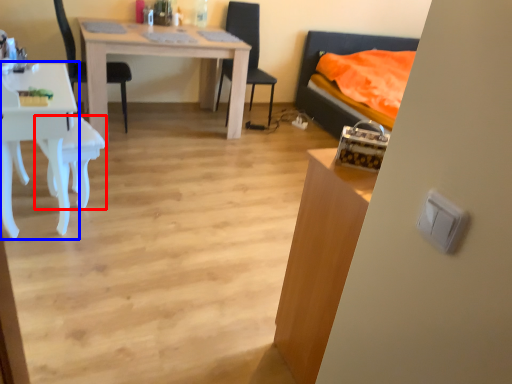
Question: Which object is closer to the camera taking this photo, armchair (highlighted by a red box) or desk (highlighted by a blue box)?

Choices:
 (A) armchair
 (B) desk

Answer: (B)